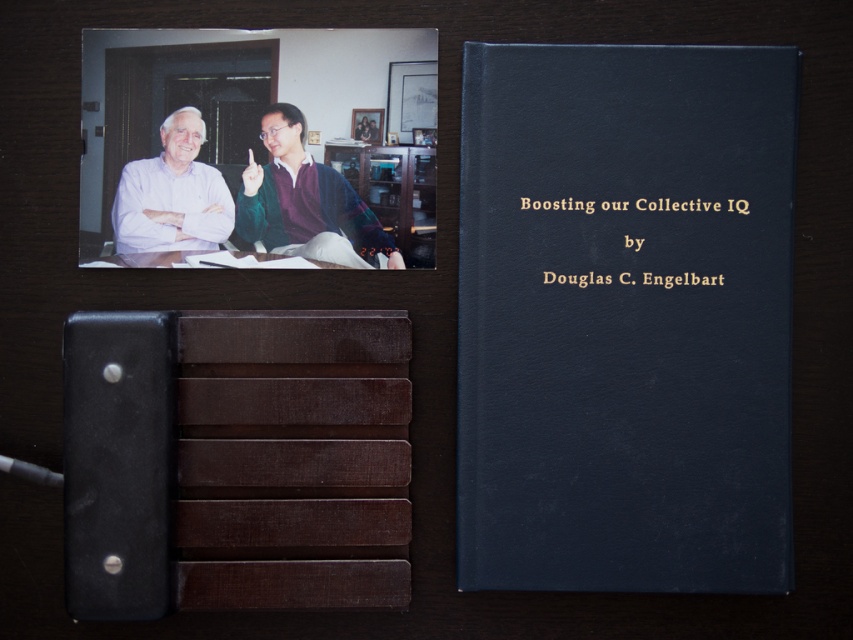
You are organizing items on a desk and need to know the spatial relationship between the dark blue leather book at center and the matte white shirt at upper left. Which object is closer to you?

The dark blue leather book at center is closer to you because it is in front of the matte white shirt at upper left.

You are a photographer trying to capture a closeup of the green sweater at upper center without the matte white shirt at upper left blocking the view. Is this possible given their positions?

The green sweater at upper center is further to the viewer than the matte white shirt at upper left, so it will block the view of the matte white shirt at upper left. Therefore, you can take a closeup of the green sweater at upper center without the matte white shirt at upper left blocking the view.

You are organizing a small exhibition and need to place the green sweater at upper center and the brown wood table at center in a display case. The display case has a height limit of 1 meter. Can both items fit vertically without exceeding the height limit?

The green sweater at upper center is bigger than the brown wood table at center, but the exact heights are not provided. However, since the sweater is an item worn on a person and the table is a furniture piece, it is likely the table is taller. If the table alone exceeds the 1 meter height limit, then both cannot fit. Without specific measurements, it is uncertain.